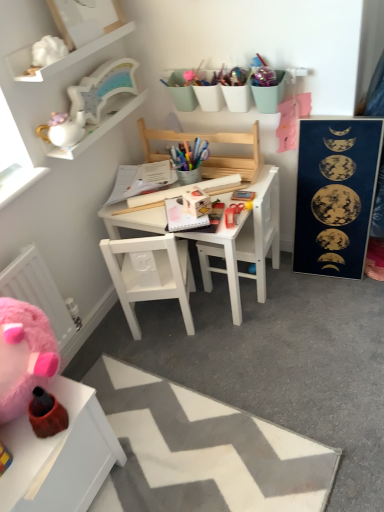
Locate an element on the screen. empty space that is in between white wooden changing table at center and white zigzag rug at lower center is located at coordinates (248, 364).